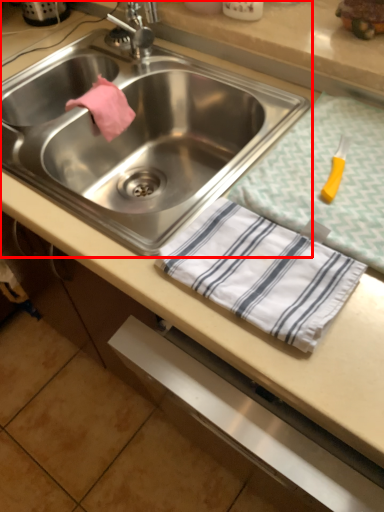
Question: From the image's perspective, considering the relative positions of sink (annotated by the red box) and tablecloth in the image provided, where is sink (annotated by the red box) located with respect to the staircase?

Choices:
 (A) below
 (B) above

Answer: (B)